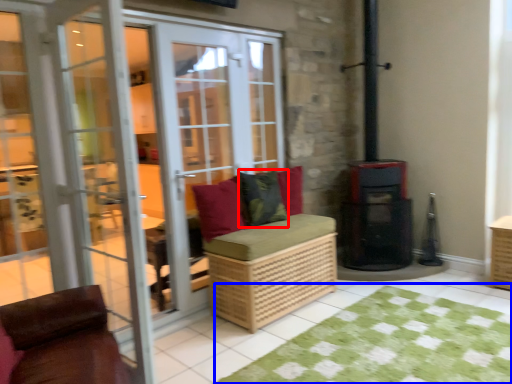
Question: Which object appears farthest to the camera in this image, pillow (highlighted by a red box) or doormat (highlighted by a blue box)?

Choices:
 (A) pillow
 (B) doormat

Answer: (A)